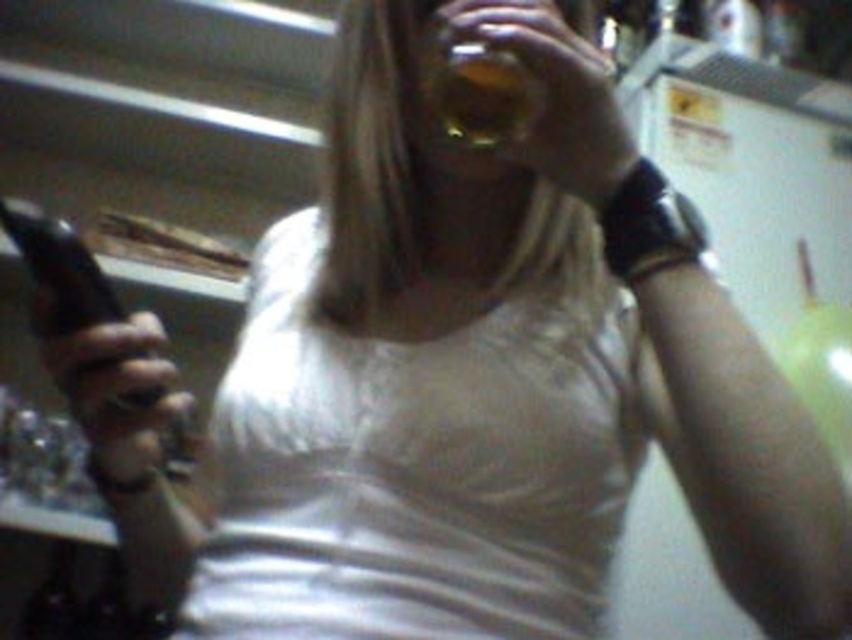
Question: Can you confirm if white matte tank top at center is positioned to the left of translucent amber liquid at upper center?

Choices:
 (A) yes
 (B) no

Answer: (A)

Question: Which point is closer to the camera?

Choices:
 (A) (436, 509)
 (B) (508, 70)

Answer: (B)

Question: Among these points, which one is nearest to the camera?

Choices:
 (A) (585, 492)
 (B) (471, 124)

Answer: (B)

Question: Does white matte tank top at center have a smaller size compared to translucent amber liquid at upper center?

Choices:
 (A) yes
 (B) no

Answer: (B)

Question: From the image, what is the correct spatial relationship of white matte tank top at center in relation to translucent amber liquid at upper center?

Choices:
 (A) right
 (B) left

Answer: (B)